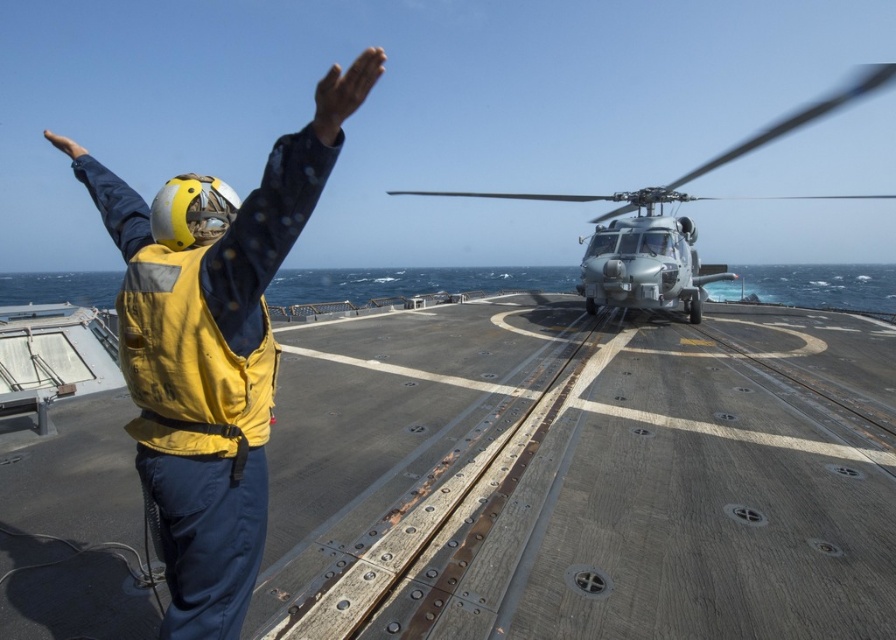
You are a crew member on the ship and need to locate the yellow fabric vest at left. According to the coordinates provided, where should you look on the deck?

The yellow fabric vest at left is located at the coordinates point (214, 353) on the deck.

You are a deckhand on the naval ship and need to move the yellow fabric vest at left and the silver metallic helicopter at center to make space for a new cargo container. Which object should you move first if you want to prioritize moving the narrower one first?

The yellow fabric vest at left is thinner than the silver metallic helicopter at center, so you should move the yellow fabric vest at left first.